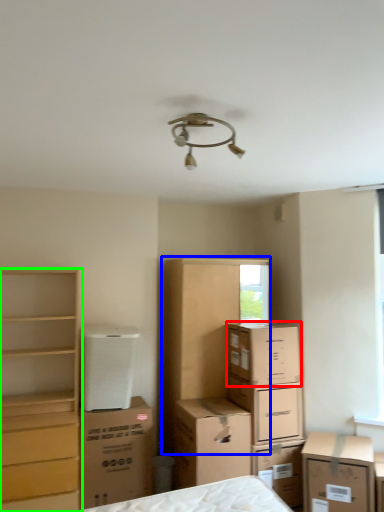
Question: Which is nearer to the cardboard box (highlighted by a red box)? dresser (highlighted by a blue box) or chest of drawers (highlighted by a green box).

Choices:
 (A) dresser
 (B) chest of drawers

Answer: (A)